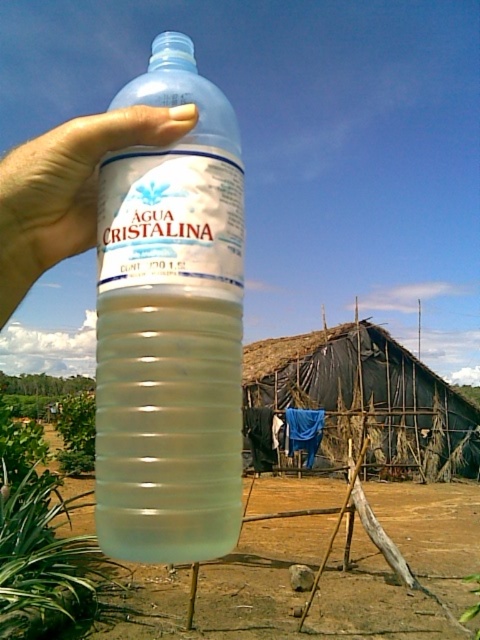
Measure the distance from translucent plastic dirt field at center to transparent plastic hand at upper left.

Result: The distance of translucent plastic dirt field at center from transparent plastic hand at upper left is 9.86 meters.

Who is positioned more to the right, translucent plastic dirt field at center or transparent plastic hand at upper left?

translucent plastic dirt field at center is more to the right.

Identify the location of translucent plastic dirt field at center. Image resolution: width=480 pixels, height=640 pixels. (284, 592).

The height and width of the screenshot is (640, 480). I want to click on translucent plastic dirt field at center, so click(x=284, y=592).

Is transparent plastic bottle at center thinner than transparent plastic hand at upper left?

Correct, transparent plastic bottle at center's width is less than transparent plastic hand at upper left's.

Is transparent plastic bottle at center taller than transparent plastic hand at upper left?

No, transparent plastic bottle at center is not taller than transparent plastic hand at upper left.

Is point (233, 419) in front of point (75, 132)?

That is True.

Where is `transparent plastic bottle at center`? The height and width of the screenshot is (640, 480). transparent plastic bottle at center is located at coordinates (170, 326).

Can you confirm if transparent plastic bottle at center is thinner than translucent plastic dirt field at center?

Yes, transparent plastic bottle at center is thinner than translucent plastic dirt field at center.

Is point (98, 540) positioned before point (420, 605)?

Yes, point (98, 540) is in front of point (420, 605).

Find the location of a particular element. transparent plastic bottle at center is located at coordinates (170, 326).